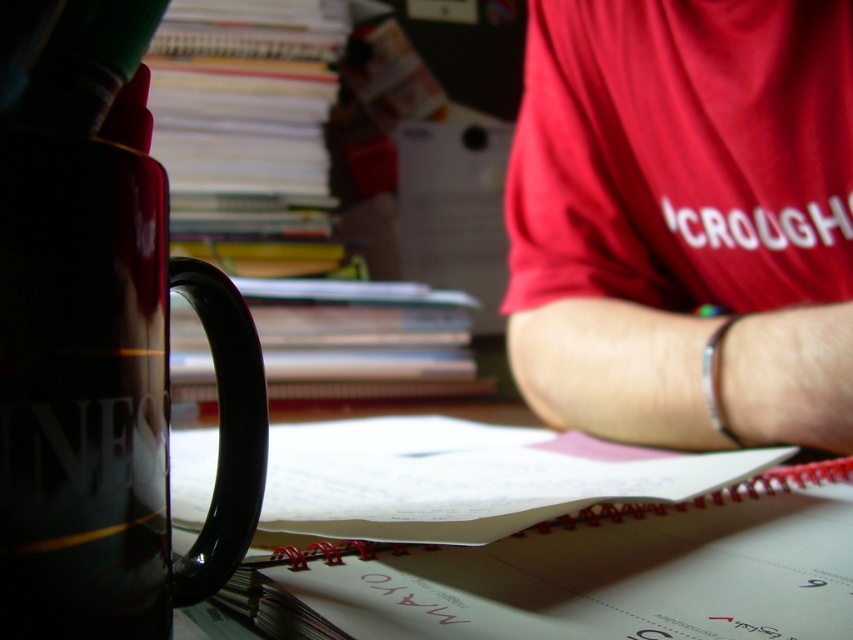
Does matte red shirt at upper right have a lesser height compared to shiny black mug at left?

No, matte red shirt at upper right is not shorter than shiny black mug at left.

Which of these two, matte red shirt at upper right or shiny black mug at left, stands taller?

Standing taller between the two is matte red shirt at upper right.

You are a GUI agent. You are given a task and a screenshot of the screen. Output one action in this format:
    pyautogui.click(x=<x>, y=<y>)
    Task: Click on the matte red shirt at upper right
    
    Given the screenshot: What is the action you would take?
    pyautogui.click(x=685, y=220)

Who is lower down, spiral-bound notebook at center or shiny black mug at left?

spiral-bound notebook at center is below.

The width and height of the screenshot is (853, 640). In order to click on spiral-bound notebook at center in this screenshot , I will do `click(543, 538)`.

Who is shorter, matte red shirt at upper right or spiral-bound notebook at center?

spiral-bound notebook at center

Between point (741, 442) and point (500, 484), which one is positioned in front?

Point (500, 484) is in front.

Is point (699, 141) farther from camera compared to point (817, 621)?

Yes.

At what (x,y) coordinates should I click in order to perform the action: click on matte red shirt at upper right. Please return your answer as a coordinate pair (x, y). Looking at the image, I should click on (685, 220).